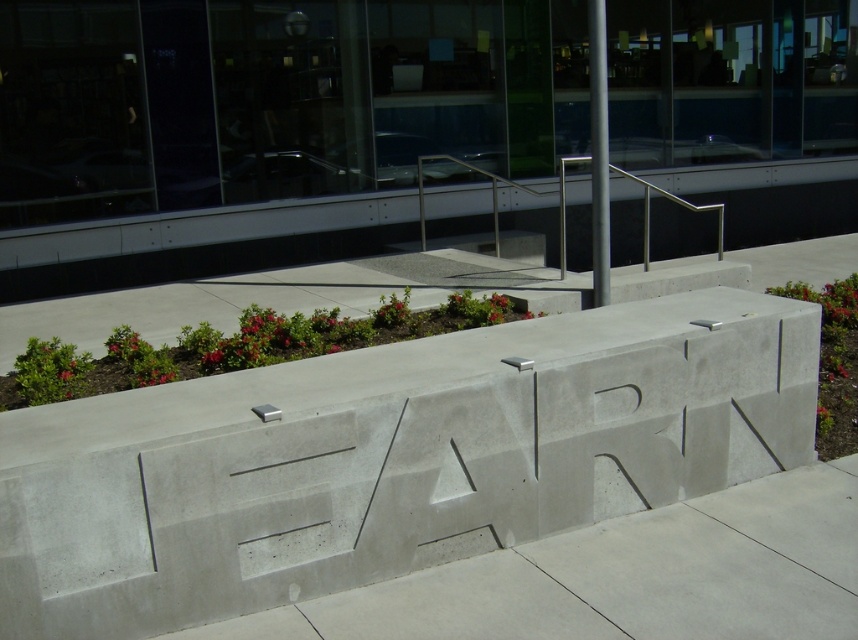
Question: Considering the relative positions of gray concrete pavement at center and silver metallic pole at center in the image provided, where is gray concrete pavement at center located with respect to silver metallic pole at center?

Choices:
 (A) left
 (B) right

Answer: (A)

Question: Estimate the real-world distances between objects in this image. Which object is farther from the silver metallic pole at center?

Choices:
 (A) gray concrete at center
 (B) gray concrete pavement at center

Answer: (B)

Question: Is gray concrete at center thinner than silver metallic pole at center?

Choices:
 (A) yes
 (B) no

Answer: (B)

Question: Is gray concrete pavement at center further to camera compared to concrete bench at upper center?

Choices:
 (A) no
 (B) yes

Answer: (A)

Question: Which point is farther to the camera?

Choices:
 (A) (76, 401)
 (B) (608, 298)

Answer: (B)

Question: Which of the following is the closest to the observer?

Choices:
 (A) tap(328, 216)
 (B) tap(606, 529)
 (C) tap(164, 420)
 (D) tap(606, 248)

Answer: (C)